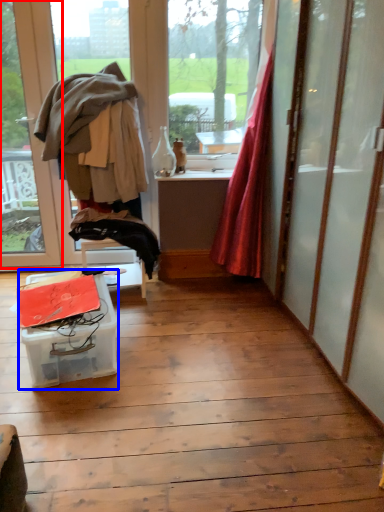
Question: Which of the following is the closest to the observer, window (highlighted by a red box) or table (highlighted by a blue box)?

Choices:
 (A) window
 (B) table

Answer: (B)